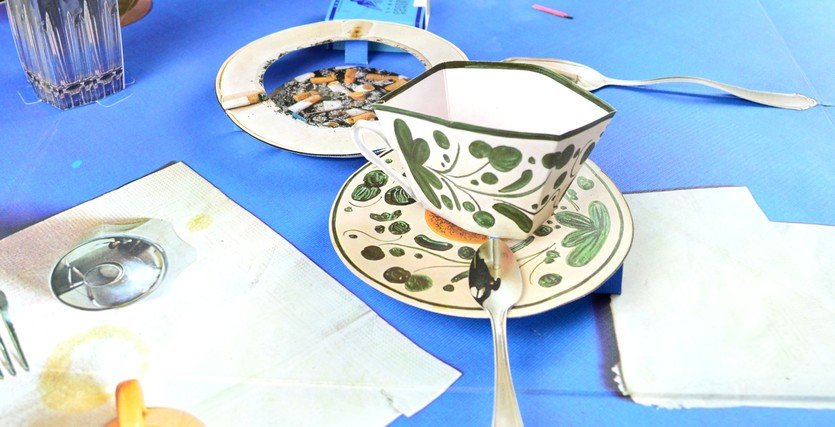
I want to click on fork, so click(14, 348).